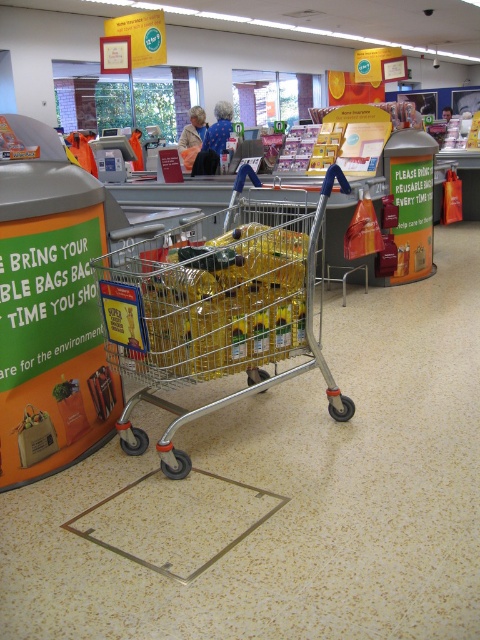
Question: Which of the following is the closest to the observer?

Choices:
 (A) metallic yellow oil at center
 (B) silver/metallic shopping cart at center

Answer: (A)

Question: Is silver/metallic shopping cart at center above metallic yellow oil at center?

Choices:
 (A) no
 (B) yes

Answer: (A)

Question: Which point is farther from the camera taking this photo?

Choices:
 (A) (133, 438)
 (B) (156, 296)

Answer: (A)

Question: Among these objects, which one is nearest to the camera?

Choices:
 (A) silver/metallic shopping cart at center
 (B) metallic yellow oil at center

Answer: (B)

Question: Is silver/metallic shopping cart at center positioned at the back of metallic yellow oil at center?

Choices:
 (A) no
 (B) yes

Answer: (B)

Question: Does silver/metallic shopping cart at center have a smaller size compared to metallic yellow oil at center?

Choices:
 (A) yes
 (B) no

Answer: (B)